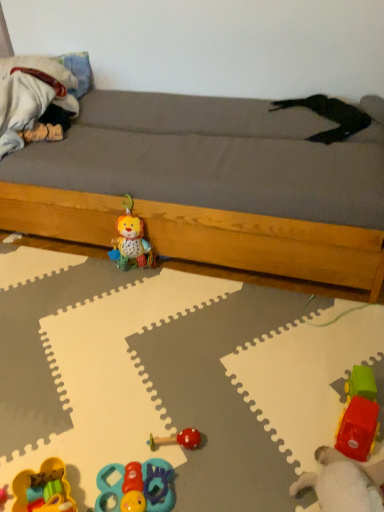
Find the location of `free space to the left of plush fabric lion at center, the 2th toy when ordered from left to right`. free space to the left of plush fabric lion at center, the 2th toy when ordered from left to right is located at coordinates (92, 274).